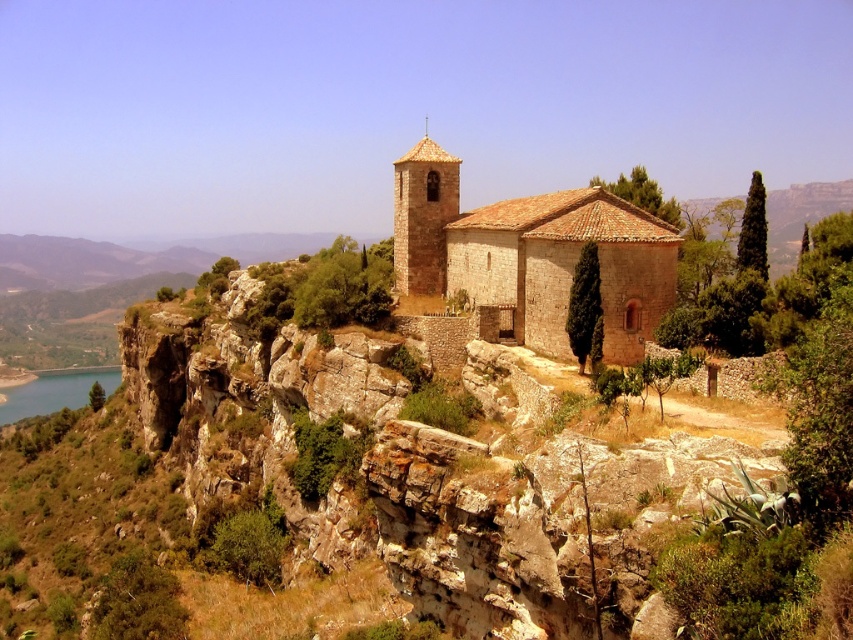
Does brown stone church at center have a lesser width compared to smooth stone tower at center?

No, brown stone church at center is not thinner than smooth stone tower at center.

Does brown stone church at center appear over smooth stone tower at center?

No, brown stone church at center is not above smooth stone tower at center.

What do you see at coordinates (523, 260) in the screenshot? I see `brown stone church at center` at bounding box center [523, 260].

You are a GUI agent. You are given a task and a screenshot of the screen. Output one action in this format:
    pyautogui.click(x=<x>, y=<y>)
    Task: Click on the brown stone church at center
    This screenshot has width=853, height=640.
    Given the screenshot: What is the action you would take?
    pyautogui.click(x=523, y=260)

Which is more to the left, brown stone church at center or blue smooth water at lower left?

blue smooth water at lower left

Who is positioned more to the right, brown stone church at center or blue smooth water at lower left?

Positioned to the right is brown stone church at center.

Between point (676, 230) and point (47, 397), which one is positioned behind?

The point (47, 397) is more distant.

Identify the location of brown stone church at center. The image size is (853, 640). 523,260.

What do you see at coordinates (422, 216) in the screenshot? I see `smooth stone tower at center` at bounding box center [422, 216].

Is smooth stone tower at center positioned at the back of blue smooth water at lower left?

No, it is in front of blue smooth water at lower left.

Where is `smooth stone tower at center`? This screenshot has width=853, height=640. smooth stone tower at center is located at coordinates (422, 216).